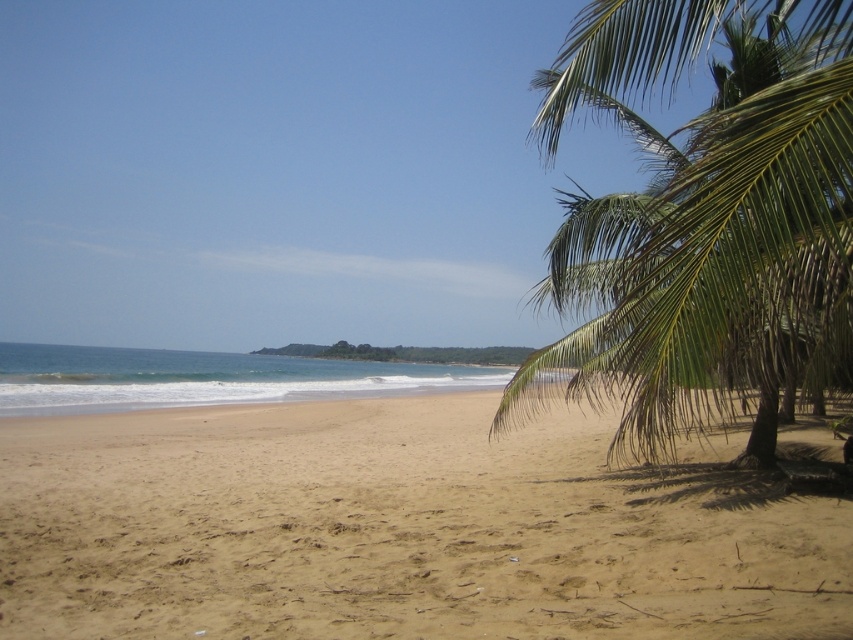
Between light brown sand at lower center and green leafy palm tree at right, which one is positioned lower?

light brown sand at lower center is below.

Which is behind, point (158, 413) or point (802, 228)?

Point (158, 413)

The height and width of the screenshot is (640, 853). What do you see at coordinates (399, 529) in the screenshot? I see `light brown sand at lower center` at bounding box center [399, 529].

Locate an element on the screen. This screenshot has width=853, height=640. light brown sand at lower center is located at coordinates (399, 529).